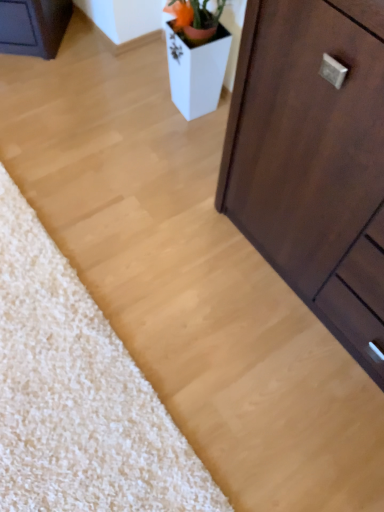
Measure the distance between white fluffy mat at lower left and camera.

3.63 feet.

What do you see at coordinates (77, 394) in the screenshot? I see `white fluffy mat at lower left` at bounding box center [77, 394].

The width and height of the screenshot is (384, 512). What are the coordinates of `white fluffy mat at lower left` in the screenshot? It's located at (77, 394).

In order to face white fluffy mat at lower left, should I rotate leftwards or rightwards?

Rotate your view left by about 21.866°.

Locate an element on the screen. This screenshot has width=384, height=512. white fluffy mat at lower left is located at coordinates click(x=77, y=394).